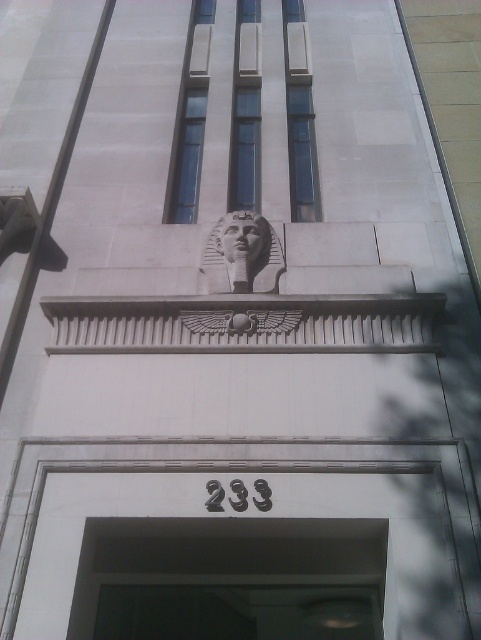
Question: Which point is closer to the camera?

Choices:
 (A) (225, 266)
 (B) (101, 550)

Answer: (B)

Question: Which point appears closest to the camera in this image?

Choices:
 (A) (253, 273)
 (B) (202, 586)

Answer: (B)

Question: Can you confirm if black glass door at center is positioned below white stone pharaoh head at center?

Choices:
 (A) yes
 (B) no

Answer: (A)

Question: In this image, where is black glass door at center located relative to white stone pharaoh head at center?

Choices:
 (A) above
 (B) below

Answer: (B)

Question: Is black glass door at center above white stone pharaoh head at center?

Choices:
 (A) yes
 (B) no

Answer: (B)